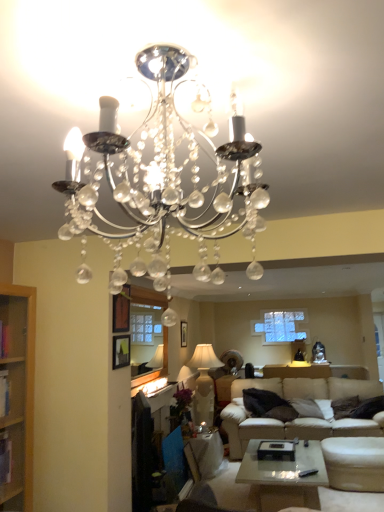
At what (x,y) coordinates should I click in order to perform the action: click on vacant space situated above clear crystal chandelier at upper center, the second lamp from the bottom (from a real-world perspective). Please return your answer as a coordinate pair (x, y). Looking at the image, I should click on (x=198, y=57).